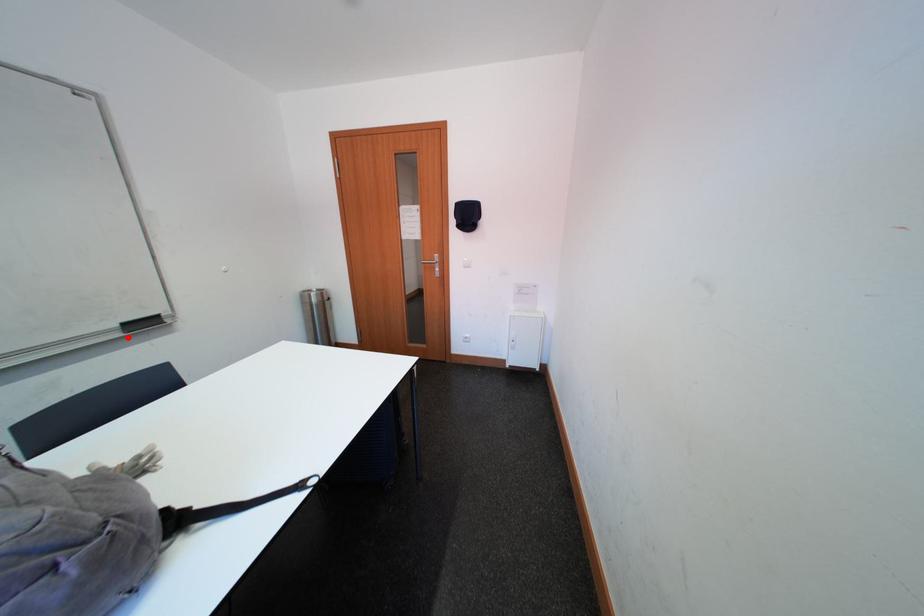
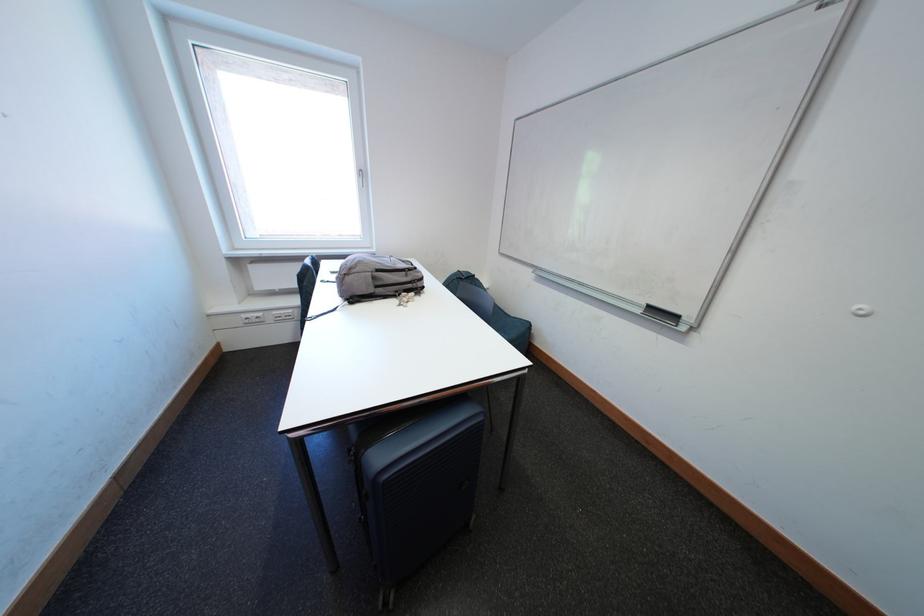
Where in the second image is the point corresponding to the highlighted location from the first image?

(649, 315)